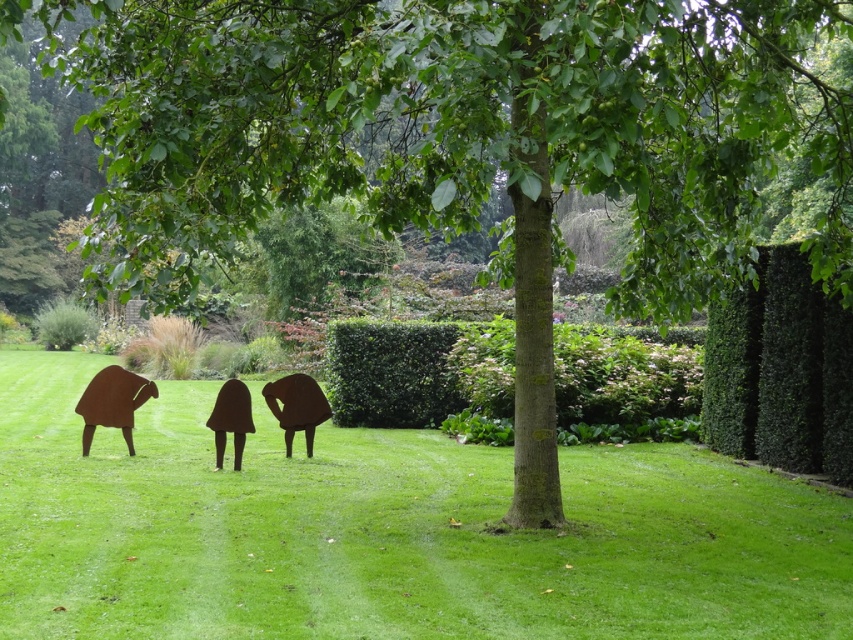
In the garden scene, there is a green leafy hedge at right and a rusty metal sculpture at center. Which object is taller?

The green leafy hedge at right is much taller than the rusty metal sculpture at center.

You are standing in the garden and want to walk from the point at coordinates point (442, 397) to the point at coordinates point (276, 400). Based on the scene description, which direction should you move relative to your current position?

You should move forward because point (442, 397) is behind point (276, 400), so moving forward will take you toward the latter.

You are a gardener who wants to plant a new flower bed between the green leafy hedge at center and the rusty metal figures at center. Based on their positions, which side of the hedge should you place the flowers to ensure they are between both objects?

The green leafy hedge at center is positioned on the right side of the rusty metal figures at center. Therefore, to place the flowers between them, you should plant them to the left side of the green leafy hedge at center, which would be between the rusty metal figures at center and the hedge.